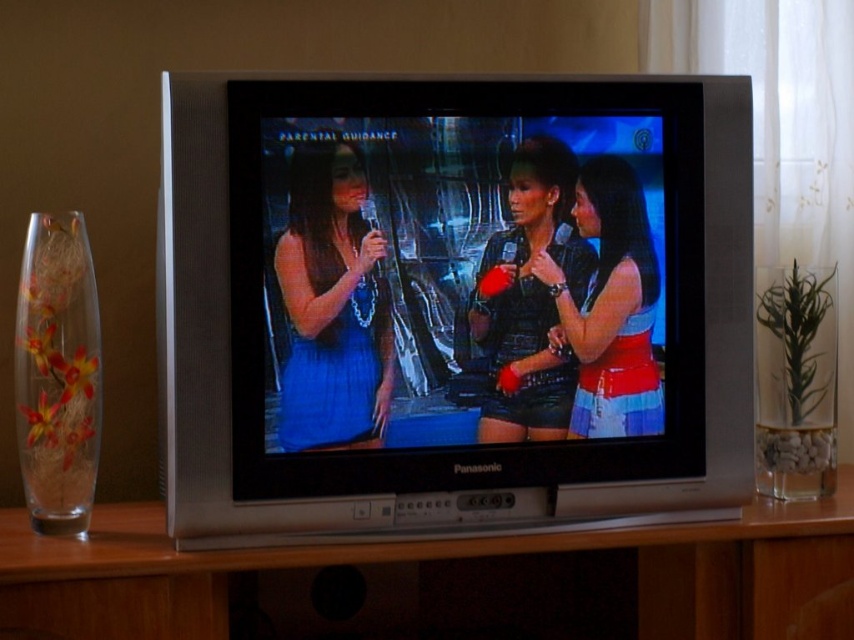
You are standing in front of the vintage Panasonic CRT television and notice the silver metallic flat screen tv at center and the matte blue dress at center. Which object is positioned closer to you?

The silver metallic flat screen tv at center is closer to the viewer than the matte blue dress at center.

You are trying to decide if the silver metallic flat screen tv at center will fit on a shelf that can hold items up to the width of the matte blue dress at center. Based on the scene, will it fit?

The silver metallic flat screen tv at center is wider than the matte blue dress at center, so it will not fit on the shelf designed for items up to the width of the matte blue dress at center.

You are standing in front of the vintage Panasonic CRT television. You want to place a decorative vase on the closest surface to you. Which object from the silver metallic entertainment center at center and the shiny red fabric top at center should you choose?

The silver metallic entertainment center at center is in front of the shiny red fabric top at center, so the silver metallic entertainment center at center is closer to you. Place the vase there.